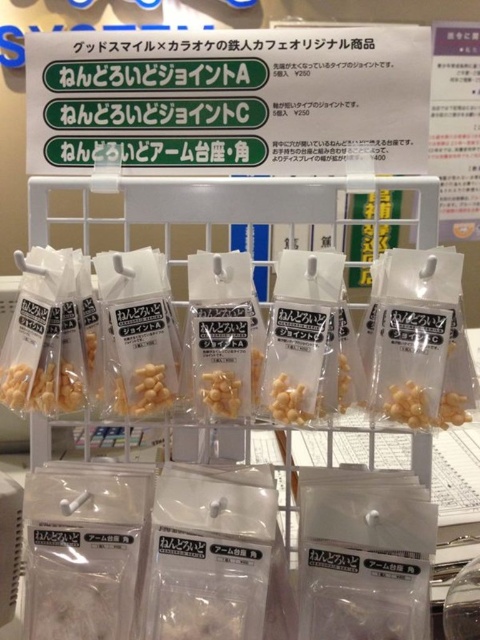
Question: Does white plastic sign at upper center appear over yellow matte joint at center?

Choices:
 (A) no
 (B) yes

Answer: (B)

Question: Can you confirm if white plastic sign at upper center is positioned above yellow matte joint at center?

Choices:
 (A) no
 (B) yes

Answer: (B)

Question: Among these points, which one is nearest to the camera?

Choices:
 (A) (396, 401)
 (B) (302, 129)
 (C) (124, 388)

Answer: (A)

Question: Is white plastic sign at upper center bigger than yellow matte joint at center?

Choices:
 (A) yes
 (B) no

Answer: (A)

Question: Which is farther from the yellow matte joint at center?

Choices:
 (A) white plastic sign at upper center
 (B) translucent plastic nuts at center

Answer: (A)

Question: Which object is closer to the camera taking this photo?

Choices:
 (A) yellow matte joint at center
 (B) white plastic sign at upper center
 (C) translucent plastic nuts at center

Answer: (C)